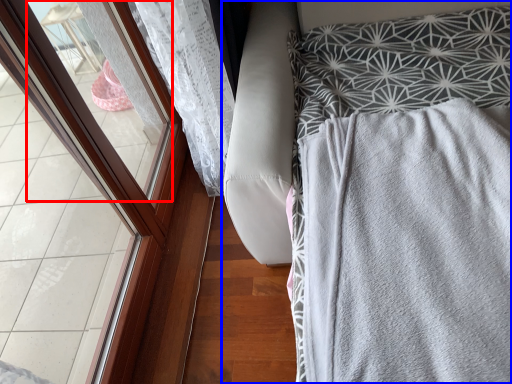
Question: Which of the following is the closest to the observer, window (highlighted by a red box) or furniture (highlighted by a blue box)?

Choices:
 (A) window
 (B) furniture

Answer: (B)